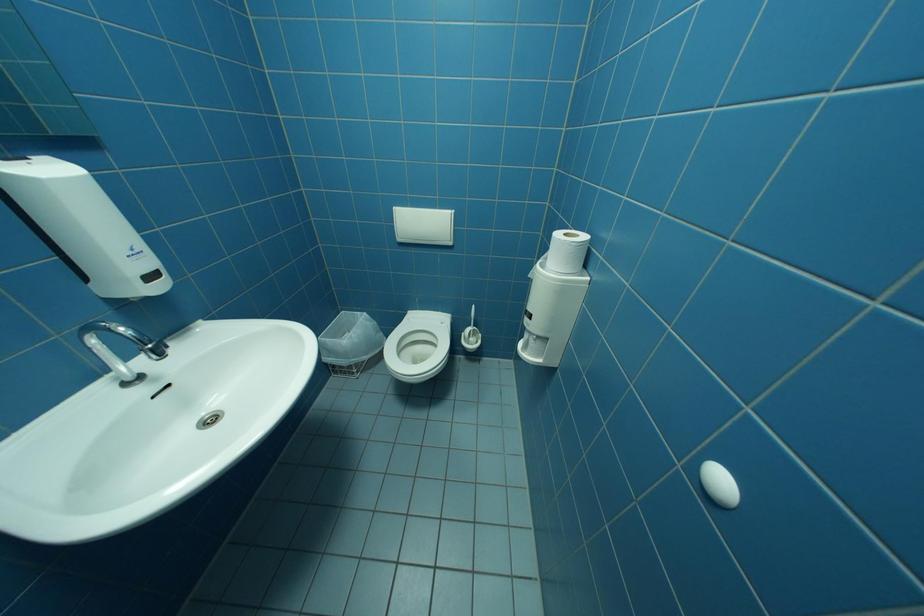
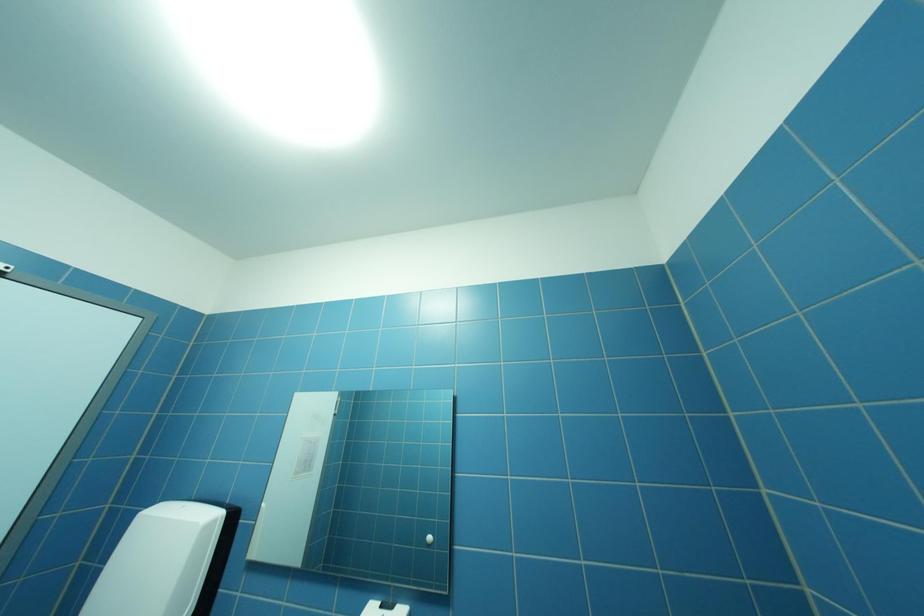
How did the camera likely rotate?

The camera rotated toward left-up.